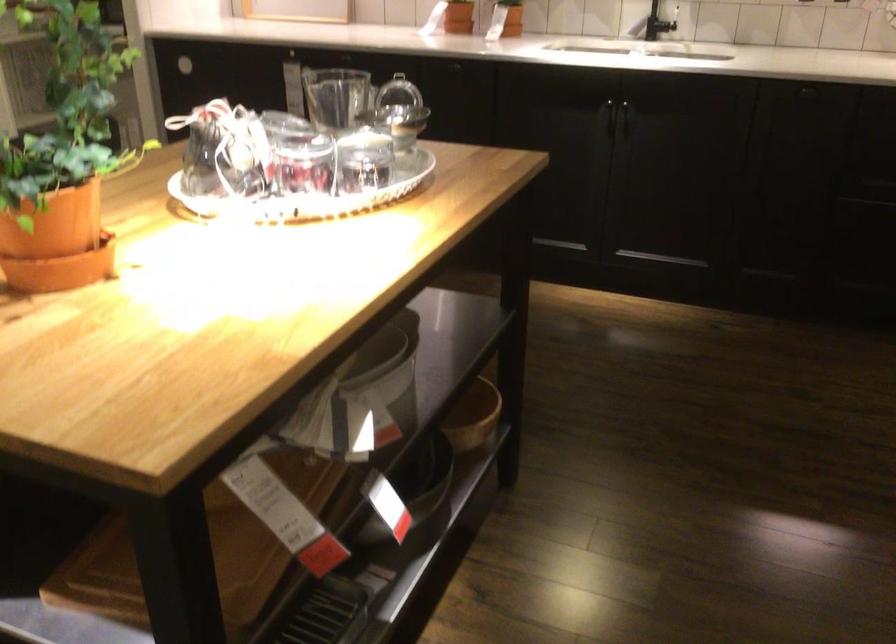
This screenshot has width=896, height=644. What are the coordinates of `white perforated tray` in the screenshot? It's located at (309, 198).